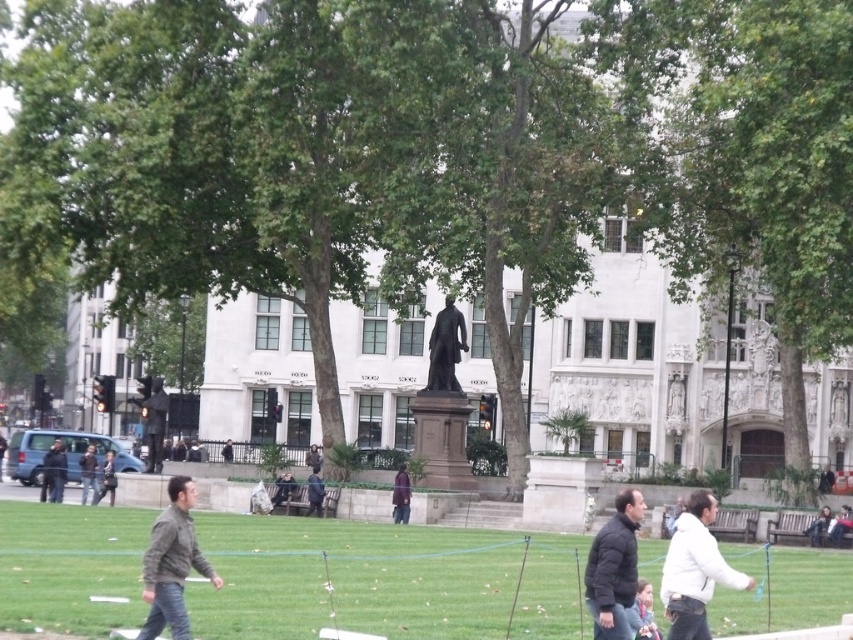
You are standing in the public square and want to find the green grass at lower center. According to the coordinates provided, where would you look relative to the statue?

The green grass at lower center is located at coordinates point (352, 579), which is to the right and slightly below the statue since the statue is centrally positioned in the frame.

You are a photographer setting up a tripod in the public square. You want to capture both the green grass at lower center and the white marble statue at center in your shot. Given that your camera has a fixed focal length, which object should you position closer to the edge of the frame to ensure both fit within the composition?

Since the green grass at lower center is wider than the white marble statue at center, you should position the wider green grass at lower center closer to the edge of the frame to ensure both fit within the composition.